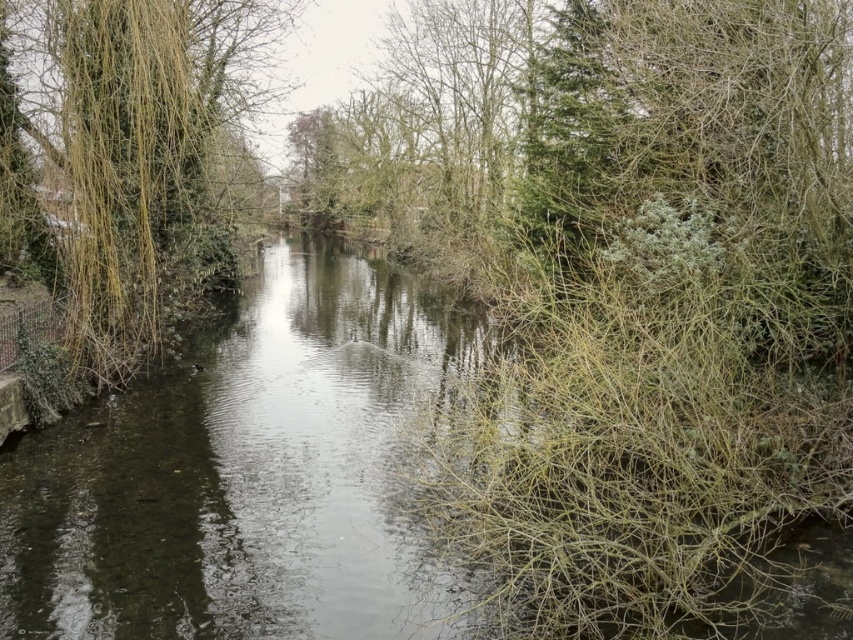
Does clear water at center have a greater width compared to green leafy tree at left?

Yes, clear water at center is wider than green leafy tree at left.

I want to click on clear water at center, so click(x=252, y=474).

Looking at this image, measure the distance between clear water at center and camera.

clear water at center and camera are 17.89 feet apart.

Locate an element on the screen. clear water at center is located at coordinates (252, 474).